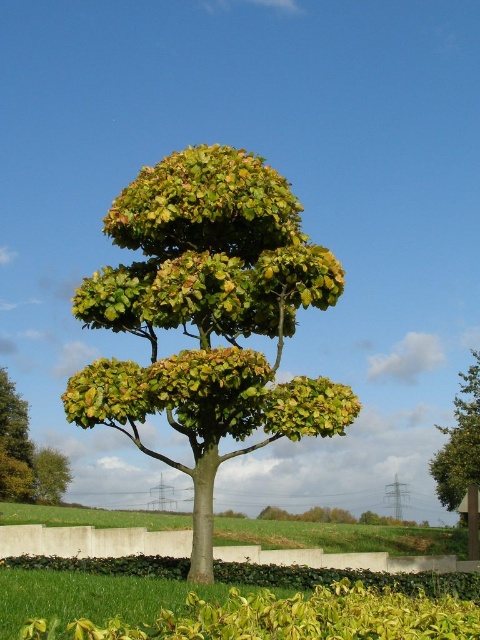
Question: Is green leafy tree at center closer to the viewer compared to green leafy grass at center?

Choices:
 (A) no
 (B) yes

Answer: (A)

Question: Which point is farther from the camera taking this photo?

Choices:
 (A) (67, 557)
 (B) (271, 616)
 (C) (26, 416)
 (D) (321, 529)

Answer: (C)

Question: Which point appears closest to the camera in this image?

Choices:
 (A) (166, 518)
 (B) (12, 381)
 (C) (458, 595)

Answer: (C)

Question: Is green grass at lower center bigger than green leafy hedge at lower center?

Choices:
 (A) no
 (B) yes

Answer: (B)

Question: Considering the relative positions of green leafy tree at center and green leafy grass at center in the image provided, where is green leafy tree at center located with respect to green leafy grass at center?

Choices:
 (A) left
 (B) right

Answer: (A)

Question: Estimate the real-world distances between objects in this image. Which object is closer to the green leafy grass at center?

Choices:
 (A) green leafy tree at left
 (B) green leafy tree at right
 (C) green leafy hedge at lower center
 (D) green leafy tree at center

Answer: (C)